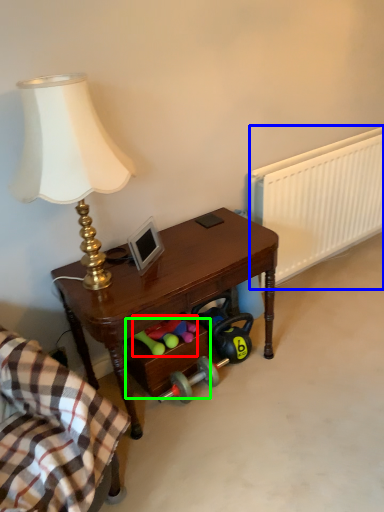
Question: Which is farther away from stuff (highlighted by a red box)? radiator (highlighted by a blue box) or drawer (highlighted by a green box)?

Choices:
 (A) radiator
 (B) drawer

Answer: (A)